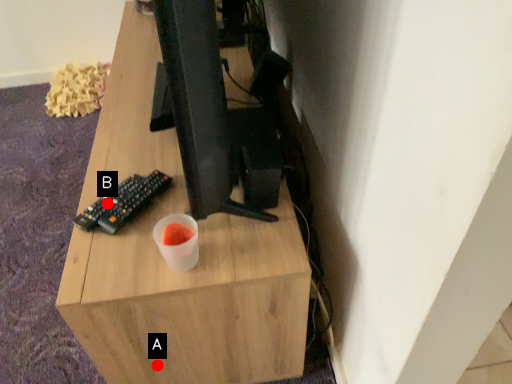
Question: Two points are circled on the image, labeled by A and B beside each circle. Among these points, which one is farthest from the camera?

Choices:
 (A) A is further
 (B) B is further

Answer: (A)